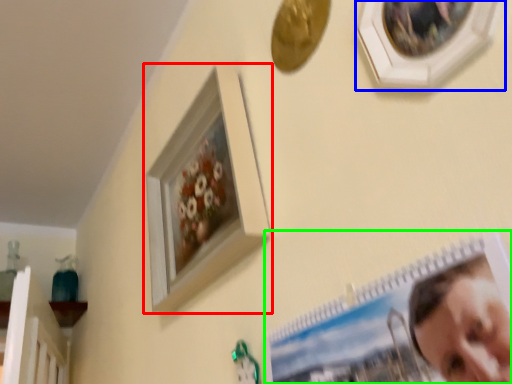
Question: Which object is the farthest from picture frame (highlighted by a red box)? Choose among these: picture frame (highlighted by a blue box) or picture frame (highlighted by a green box).

Choices:
 (A) picture frame
 (B) picture frame

Answer: (A)